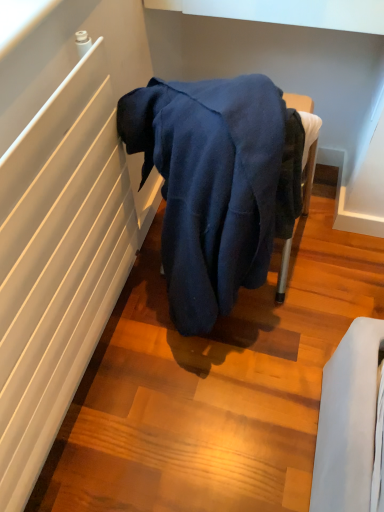
In order to click on free space below white smooth radiator at left (from a real-world perspective) in this screenshot , I will do `click(91, 382)`.